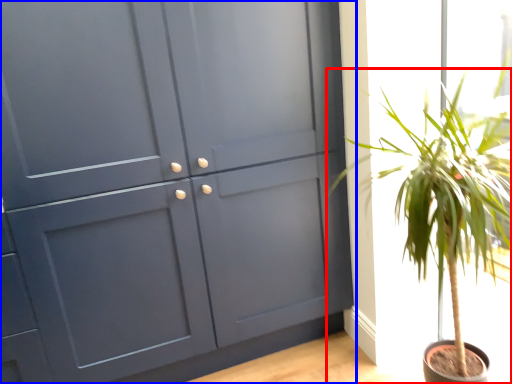
Question: Which object appears farthest to the camera in this image, houseplant (highlighted by a red box) or cupboard (highlighted by a blue box)?

Choices:
 (A) houseplant
 (B) cupboard

Answer: (B)